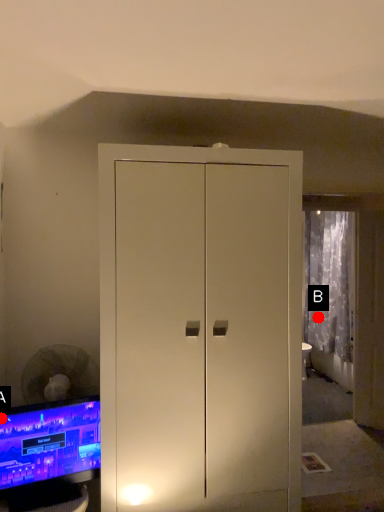
Question: Two points are circled on the image, labeled by A and B beside each circle. Which point is closer to the camera taking this photo?

Choices:
 (A) A is closer
 (B) B is closer

Answer: (A)